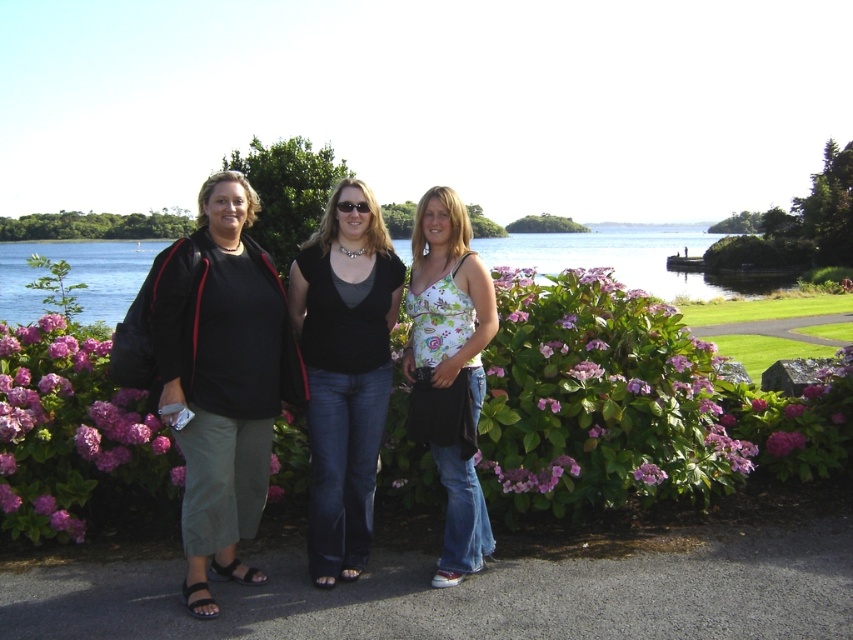
Which is behind, point (184, 419) or point (471, 518)?

Point (471, 518)

Does matte black jacket at left have a greater width compared to floral print tank top at center?

Correct, the width of matte black jacket at left exceeds that of floral print tank top at center.

The width and height of the screenshot is (853, 640). I want to click on matte black jacket at left, so click(x=222, y=381).

Identify the location of matte black jacket at left. Image resolution: width=853 pixels, height=640 pixels. (222, 381).

Who is lower down, matte black top at center or floral print tank top at center?

floral print tank top at center

The height and width of the screenshot is (640, 853). In order to click on matte black top at center in this screenshot , I will do click(344, 371).

Where is `matte black top at center`? matte black top at center is located at coordinates (344, 371).

Is matte black jacket at left bigger than purple matte flower at center?

Indeed, matte black jacket at left has a larger size compared to purple matte flower at center.

Between matte black jacket at left and purple matte flower at center, which one has less height?

purple matte flower at center

Which is behind, point (209, 189) or point (793, 442)?

The point (793, 442) is behind.

At what (x,y) coordinates should I click in order to perform the action: click on matte black jacket at left. Please return your answer as a coordinate pair (x, y). Looking at the image, I should click on (222, 381).